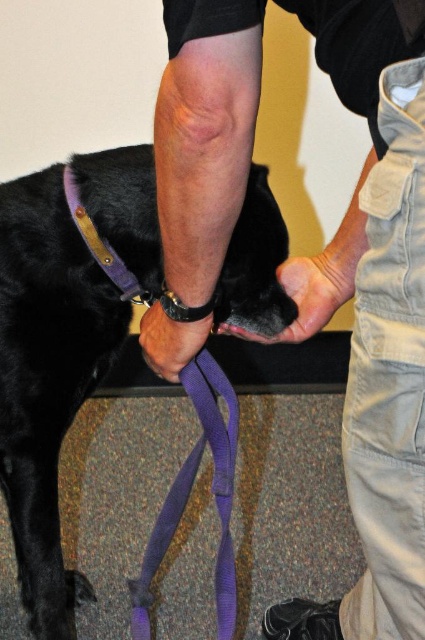
Question: Which of the following is the farthest from the observer?

Choices:
 (A) purple fabric leash at center
 (B) purple fabric leash at lower left

Answer: (A)

Question: Can you confirm if purple fabric strap at center is thinner than purple fabric strap at upper left?

Choices:
 (A) yes
 (B) no

Answer: (B)

Question: Is purple fabric leash at lower left smaller than purple fabric leash at center?

Choices:
 (A) no
 (B) yes

Answer: (B)

Question: Which of the following is the farthest from the observer?

Choices:
 (A) purple fabric strap at upper left
 (B) purple fabric strap at center

Answer: (A)

Question: Which object is positioned farthest from the purple fabric leash at center?

Choices:
 (A) purple fabric strap at upper left
 (B) purple fabric leash at lower left
 (C) purple fabric strap at center

Answer: (B)

Question: Is purple fabric strap at center further to camera compared to purple fabric strap at upper left?

Choices:
 (A) yes
 (B) no

Answer: (B)